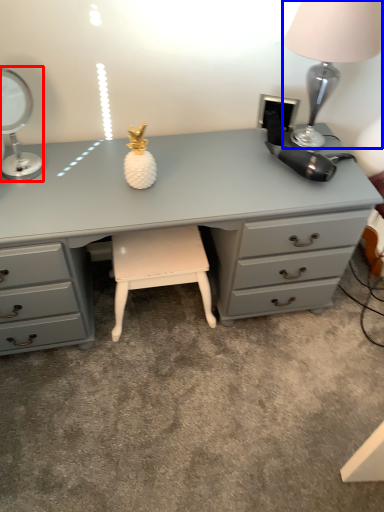
Question: Which object appears closest to the camera in this image, table lamp (highlighted by a red box) or table lamp (highlighted by a blue box)?

Choices:
 (A) table lamp
 (B) table lamp

Answer: (B)